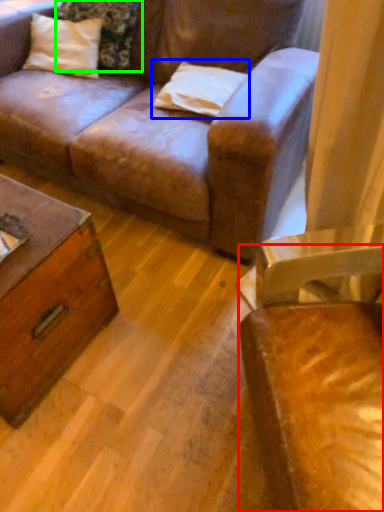
Question: Considering the real-world distances, which object is farthest from chair (highlighted by a red box)? pillow (highlighted by a blue box) or pillow (highlighted by a green box)?

Choices:
 (A) pillow
 (B) pillow

Answer: (B)